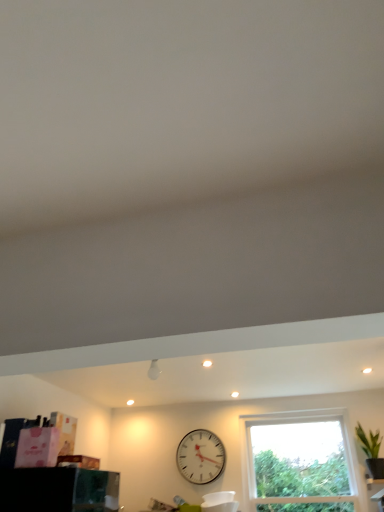
Question: Is transparent glass window at center wider than matte white cabinet at lower right?

Choices:
 (A) yes
 (B) no

Answer: (B)

Question: Is transparent glass window at center outside of matte white cabinet at lower right?

Choices:
 (A) no
 (B) yes

Answer: (B)

Question: Does transparent glass window at center touch matte white cabinet at lower right?

Choices:
 (A) yes
 (B) no

Answer: (B)

Question: Is transparent glass window at center closer to the viewer compared to matte white cabinet at lower right?

Choices:
 (A) no
 (B) yes

Answer: (A)

Question: Is transparent glass window at center not near matte white cabinet at lower right?

Choices:
 (A) yes
 (B) no

Answer: (B)

Question: Would you say transparent glass window at center contains matte white cabinet at lower right?

Choices:
 (A) no
 (B) yes

Answer: (A)

Question: Is matte white cabinet at lower right wider than transparent glass window at center?

Choices:
 (A) no
 (B) yes

Answer: (B)

Question: Does matte white cabinet at lower right have a smaller size compared to transparent glass window at center?

Choices:
 (A) no
 (B) yes

Answer: (B)

Question: From a real-world perspective, does matte white cabinet at lower right stand above transparent glass window at center?

Choices:
 (A) yes
 (B) no

Answer: (B)

Question: From the image's perspective, would you say matte white cabinet at lower right is positioned over transparent glass window at center?

Choices:
 (A) no
 (B) yes

Answer: (A)

Question: Is matte white cabinet at lower right behind transparent glass window at center?

Choices:
 (A) no
 (B) yes

Answer: (A)

Question: Is matte white cabinet at lower right next to transparent glass window at center and touching it?

Choices:
 (A) yes
 (B) no

Answer: (B)

Question: Is green leafy plant at right not close to matte white cabinet at lower right?

Choices:
 (A) yes
 (B) no

Answer: (B)